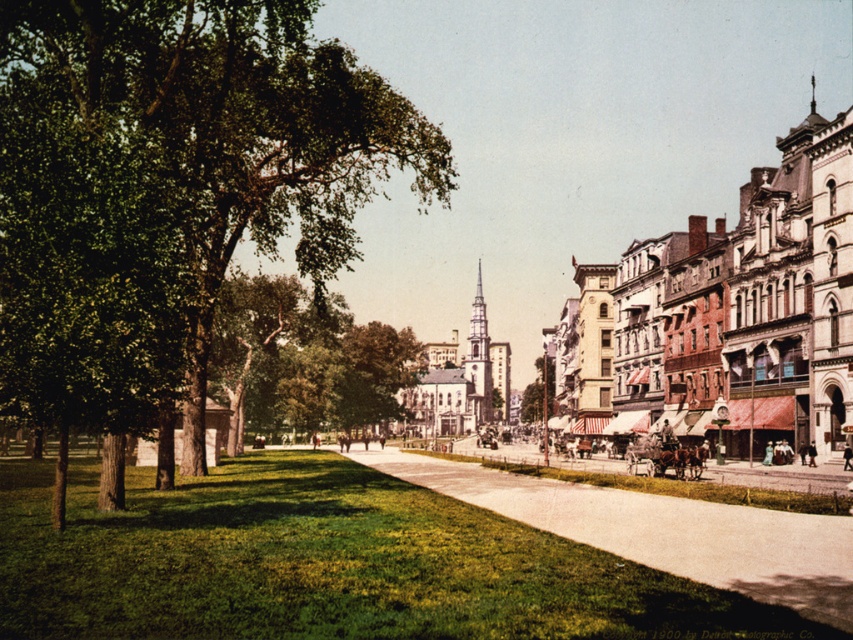
You are a pedestrian standing at the edge of the green leafy tree at left and want to walk to the smooth concrete sidewalk at center. Which direction should you move to reach the sidewalk?

The smooth concrete sidewalk at center is behind the green leafy tree at left, so you should move backward to reach it.

You are a pedestrian walking on the smooth concrete sidewalk at center in the middle of a busy street. You want to take a shortcut to the park on the left. Is the green leafy tree at left a good landmark to guide you towards the park?

Yes, the green leafy tree at left is positioned over the smooth concrete sidewalk at center, so following the sidewalk towards the tree will lead you to the park on the left.